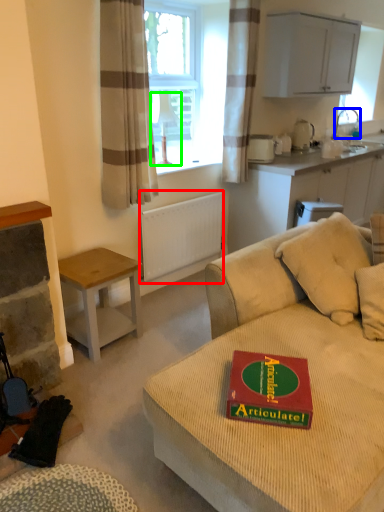
Question: Which object is positioned closest to radiator (highlighted by a red box)? Select from faucet (highlighted by a blue box) and lamp (highlighted by a green box).

Choices:
 (A) faucet
 (B) lamp

Answer: (B)